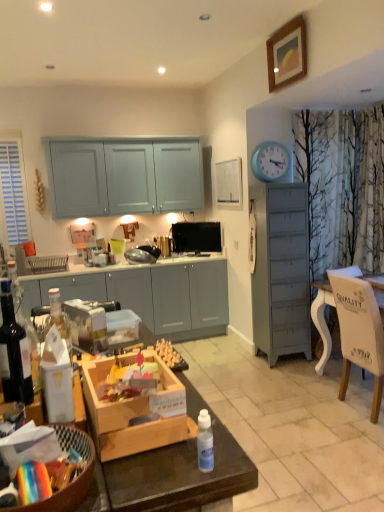
Where is `free spot above wooden picture frame at upper center, positioned as the 2th picture frame in back-to-front order (from a real-world perspective)`? The height and width of the screenshot is (512, 384). free spot above wooden picture frame at upper center, positioned as the 2th picture frame in back-to-front order (from a real-world perspective) is located at coordinates (284, 26).